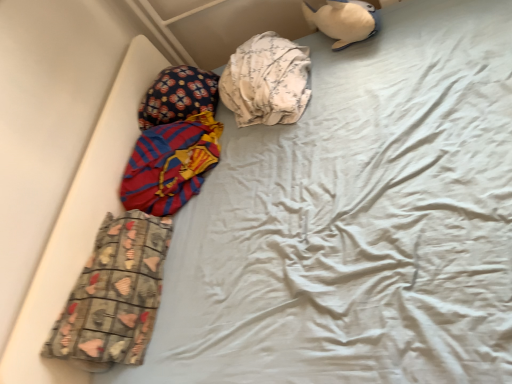
Question: Is red and blue striped fabric at left, which ranks as the 2th material in bottom-to-top order, not inside fluffy fabric pillow at upper left?

Choices:
 (A) yes
 (B) no

Answer: (A)

Question: Does red and blue striped fabric at left, the 2th material when ordered from top to bottom, come behind fluffy fabric pillow at upper left?

Choices:
 (A) yes
 (B) no

Answer: (B)

Question: Is red and blue striped fabric at left, the 2th material when ordered from top to bottom, shorter than fluffy fabric pillow at upper left?

Choices:
 (A) no
 (B) yes

Answer: (B)

Question: From a real-world perspective, is red and blue striped fabric at left, which ranks as the 2th material in bottom-to-top order, located beneath fluffy fabric pillow at upper left?

Choices:
 (A) no
 (B) yes

Answer: (B)

Question: Is red and blue striped fabric at left, which ranks as the 2th material in bottom-to-top order, positioned far away from fluffy fabric pillow at upper left?

Choices:
 (A) no
 (B) yes

Answer: (A)

Question: Looking at the image, does red and blue striped fabric at left, which ranks as the 2th material in bottom-to-top order, seem bigger or smaller compared to white floral fabric at center, positioned as the third material in bottom-to-top order?

Choices:
 (A) big
 (B) small

Answer: (B)

Question: Is point (138, 162) closer or farther from the camera than point (295, 109)?

Choices:
 (A) farther
 (B) closer

Answer: (A)

Question: Based on their positions, is red and blue striped fabric at left, which ranks as the 2th material in bottom-to-top order, located to the left or right of white floral fabric at center, positioned as the third material in bottom-to-top order?

Choices:
 (A) left
 (B) right

Answer: (A)

Question: Which is correct: red and blue striped fabric at left, the 2th material when ordered from top to bottom, is inside white floral fabric at center, the 1th material in the top-to-bottom sequence, or outside of it?

Choices:
 (A) inside
 (B) outside

Answer: (B)

Question: Considering their positions, is white plush toy at upper right located in front of or behind printed fabric pants at lower left, positioned as the 1th material in bottom-to-top order?

Choices:
 (A) front
 (B) behind

Answer: (B)

Question: Considering the positions of white plush toy at upper right and printed fabric pants at lower left, positioned as the 1th material in bottom-to-top order, in the image, is white plush toy at upper right taller or shorter than printed fabric pants at lower left, positioned as the 1th material in bottom-to-top order,?

Choices:
 (A) tall
 (B) short

Answer: (A)

Question: Based on their sizes in the image, would you say white plush toy at upper right is bigger or smaller than printed fabric pants at lower left, acting as the third material starting from the top?

Choices:
 (A) small
 (B) big

Answer: (A)

Question: Is white plush toy at upper right inside the boundaries of printed fabric pants at lower left, acting as the third material starting from the top, or outside?

Choices:
 (A) inside
 (B) outside

Answer: (B)

Question: Considering the positions of white floral fabric at center, the 1th material in the top-to-bottom sequence, and red and blue striped fabric at left, which ranks as the 2th material in bottom-to-top order, in the image, is white floral fabric at center, the 1th material in the top-to-bottom sequence, bigger or smaller than red and blue striped fabric at left, which ranks as the 2th material in bottom-to-top order,?

Choices:
 (A) big
 (B) small

Answer: (A)

Question: From a real-world perspective, is white floral fabric at center, the 1th material in the top-to-bottom sequence, above or below red and blue striped fabric at left, which ranks as the 2th material in bottom-to-top order?

Choices:
 (A) above
 (B) below

Answer: (A)